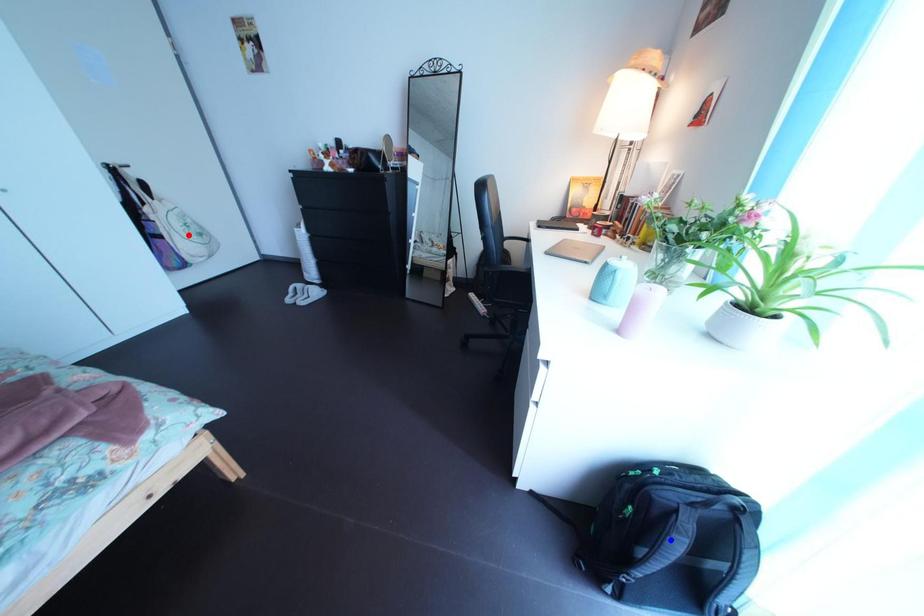
Question: In the image, two points are highlighted. Which point is nearer to the camera? Reply with the corresponding letter.

Choices:
 (A) blue point
 (B) red point

Answer: (A)